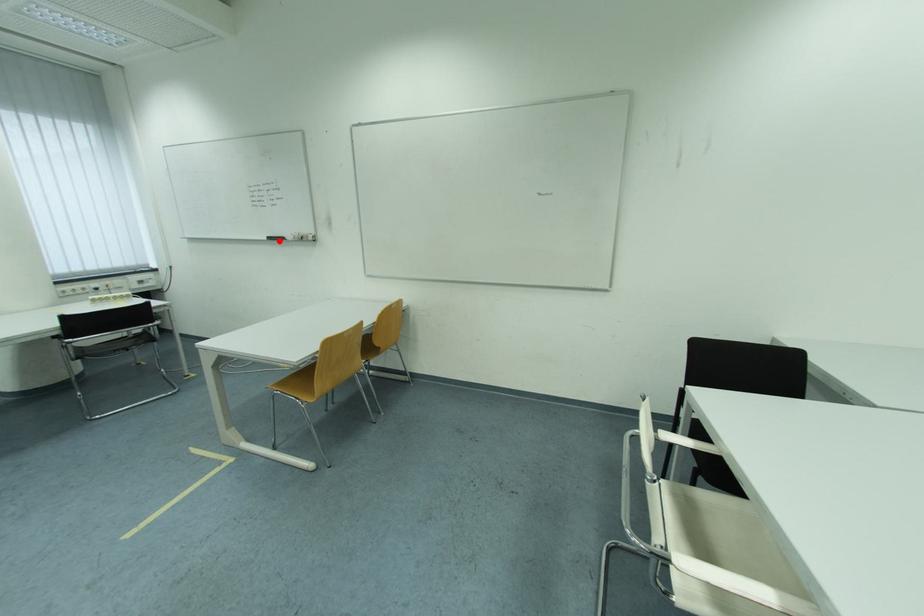
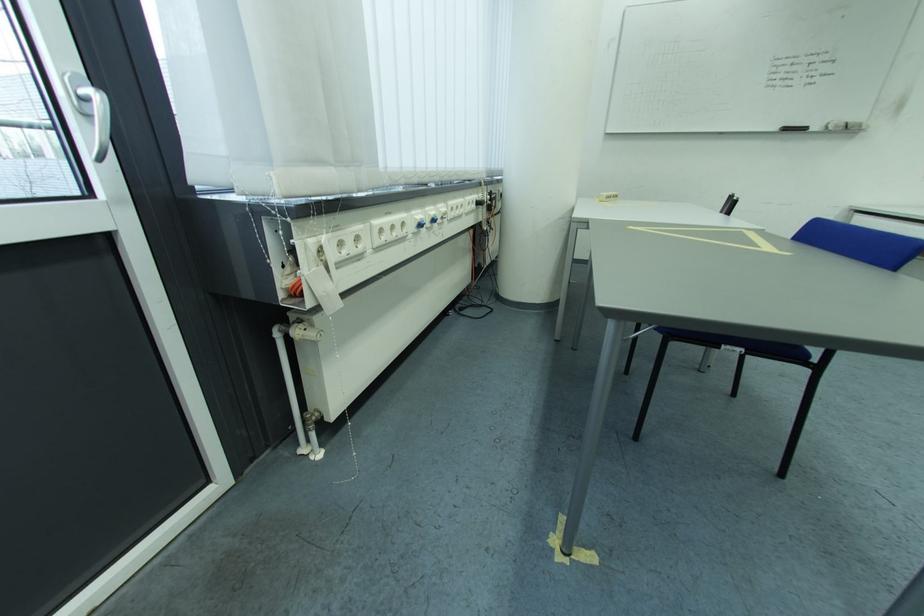
Where in the second image is the point corresponding to the highlighted location from the first image?

(796, 131)